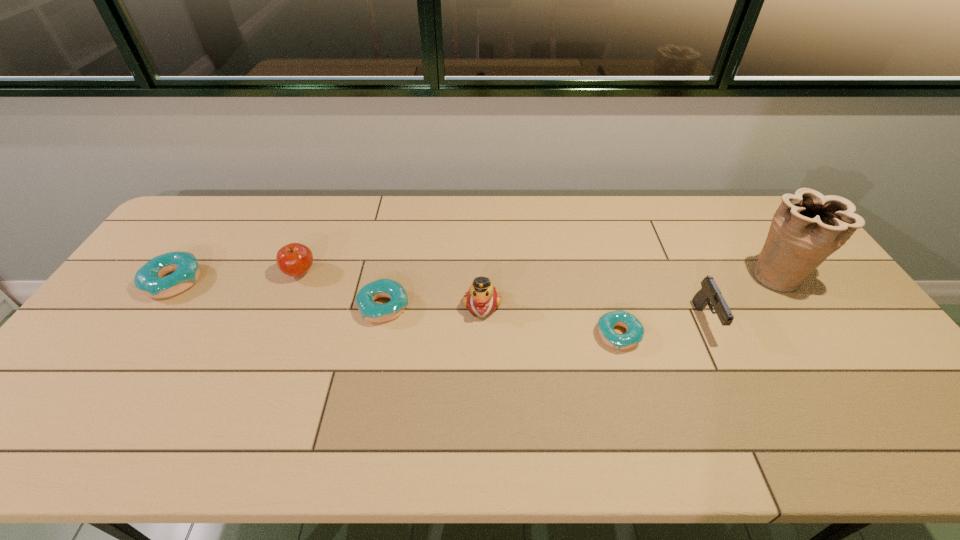
Identify the location of vacant space at the near edge of the desktop. Image resolution: width=960 pixels, height=540 pixels. click(423, 387).

You are a GUI agent. You are given a task and a screenshot of the screen. Output one action in this format:
    pyautogui.click(x=<x>, y=<y>)
    Task: Click on the vacant point at the left edge
    Image resolution: width=960 pixels, height=540 pixels.
    Given the screenshot: What is the action you would take?
    pyautogui.click(x=123, y=338)

At what (x,y) coordinates should I click in order to perform the action: click on free space at the right edge of the desktop. Please return your answer as a coordinate pair (x, y). Looking at the image, I should click on (884, 369).

Identify the location of vacant space at the far left corner of the desktop. (211, 225).

The width and height of the screenshot is (960, 540). What are the coordinates of `empty space that is in between the pistol and the second object from left to right` in the screenshot? It's located at (503, 296).

Where is `free space between the pistol and the second doughnut from left to right`? This screenshot has height=540, width=960. free space between the pistol and the second doughnut from left to right is located at coordinates (544, 314).

Where is `vacant space in between the duck and the tallest object`? vacant space in between the duck and the tallest object is located at coordinates (631, 291).

The height and width of the screenshot is (540, 960). In order to click on free space between the urn and the fourth object from right to left in this screenshot , I will do pyautogui.click(x=631, y=291).

Image resolution: width=960 pixels, height=540 pixels. In order to click on vacant space that's between the shortest object and the pistol in this screenshot , I will do `click(662, 328)`.

Locate an element on the screen. The image size is (960, 540). vacant area that lies between the sixth object from left to right and the sixth tallest object is located at coordinates (544, 314).